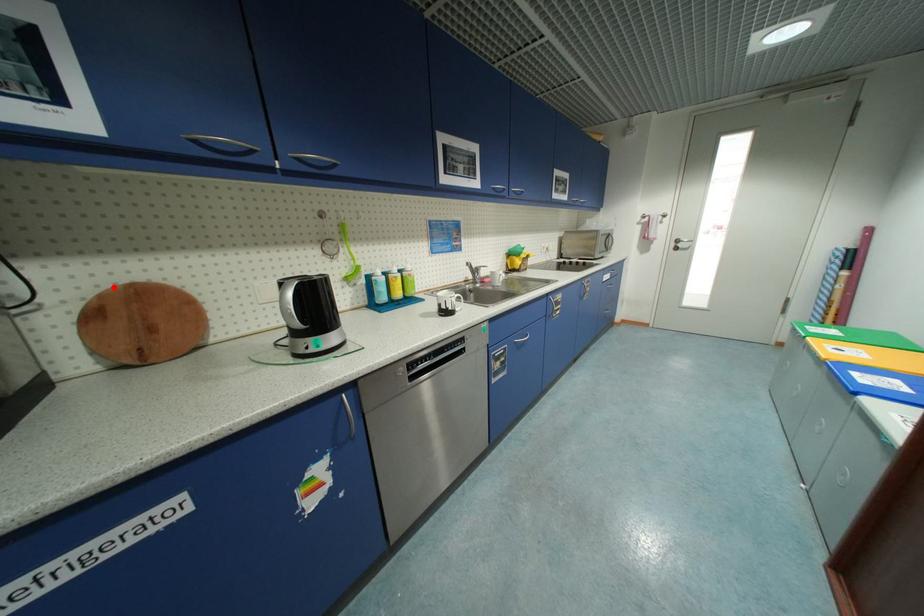
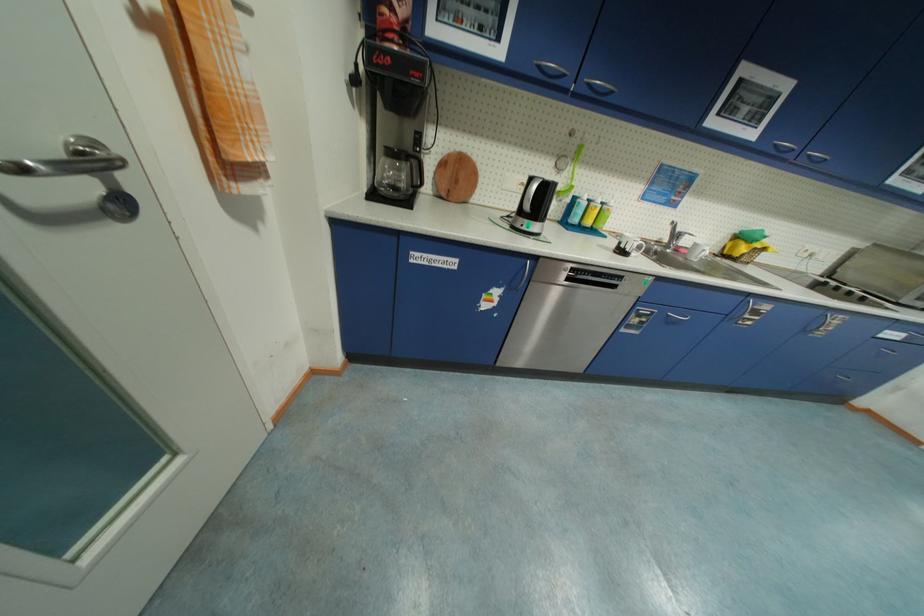
Question: I am providing you with two images of the same scene from different viewpoints. Image1 has a red point marked. In image2, the corresponding 3D location appears at what relative position? Reply with the corresponding letter.

Choices:
 (A) Closer
 (B) Farther

Answer: (A)